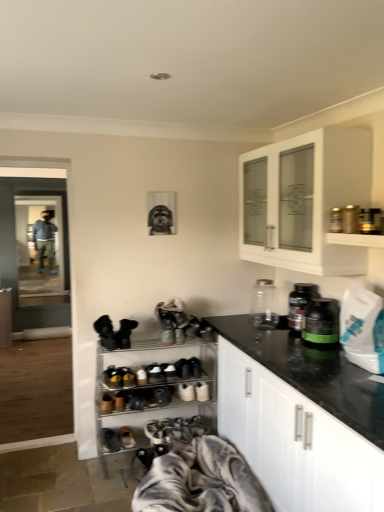
The image size is (384, 512). What do you see at coordinates (5, 317) in the screenshot?
I see `white glossy cabinet at left, placed as the second cabinetry when sorted from top to bottom` at bounding box center [5, 317].

The height and width of the screenshot is (512, 384). What are the coordinates of `metallic shoe rack at lower center, acting as the second shelf starting from the top` in the screenshot? It's located at pyautogui.click(x=155, y=388).

Could you tell me if white glossy cabinet at upper right, the 3th cabinetry when ordered from bottom to top, is turned towards transparent glass jar at right?

No, white glossy cabinet at upper right, the 3th cabinetry when ordered from bottom to top, does not turn towards transparent glass jar at right.

Does white glossy cabinet at upper right, the first cabinetry in the top-to-bottom sequence, appear on the right side of transparent glass jar at right?

Yes.

Is white glossy cabinet at upper right, which is the second cabinetry from front to back, not close to transparent glass jar at right?

No.

From the image's perspective, is white glossy cabinet at upper right, the first cabinetry in the top-to-bottom sequence, located above transparent glass jar at right?

Indeed, from the image's perspective, white glossy cabinet at upper right, the first cabinetry in the top-to-bottom sequence, is shown above transparent glass jar at right.

Based on the photo, considering the positions of objects white glossy shelf at upper right, the first shelf viewed from the top, and transparent glass jar at right in the image provided, who is more to the left, white glossy shelf at upper right, the first shelf viewed from the top, or transparent glass jar at right?

transparent glass jar at right.

In the image, there is a white glossy shelf at upper right, the second shelf when ordered from bottom to top. Where is `glass jar below it (from a real-world perspective)`? The width and height of the screenshot is (384, 512). glass jar below it (from a real-world perspective) is located at coordinates click(264, 305).

Can you tell me how much white glossy shelf at upper right, which is the first shelf in front-to-back order, and transparent glass jar at right differ in facing direction?

The facing directions of white glossy shelf at upper right, which is the first shelf in front-to-back order, and transparent glass jar at right are 0.091 degrees apart.

Does white glossy shelf at upper right, positioned as the 2th shelf in back-to-front order, have a smaller size compared to transparent glass jar at right?

Indeed, white glossy shelf at upper right, positioned as the 2th shelf in back-to-front order, has a smaller size compared to transparent glass jar at right.

From the image's perspective, which is above, black suede shoes at lower center, the 1th footwear positioned from the bottom, or black suede shoe at lower left, the fourth shoe positioned from the right?

black suede shoe at lower left, the fourth shoe positioned from the right, appears higher in the image.

Visually, is black suede shoes at lower center, which ranks as the fifth footwear in top-to-bottom order, positioned to the left or to the right of black suede shoe at lower left, the fourth shoe positioned from the right?

From the image, it's evident that black suede shoes at lower center, which ranks as the fifth footwear in top-to-bottom order, is to the right of black suede shoe at lower left, the fourth shoe positioned from the right.

Considering the relative sizes of black suede shoes at lower center, which ranks as the fifth footwear in top-to-bottom order, and black suede shoe at lower left, the first shoe from the left, in the image provided, is black suede shoes at lower center, which ranks as the fifth footwear in top-to-bottom order, wider than black suede shoe at lower left, the first shoe from the left,?

No, black suede shoes at lower center, which ranks as the fifth footwear in top-to-bottom order, is not wider than black suede shoe at lower left, the first shoe from the left.

From a real-world perspective, is black suede shoes at lower center, which ranks as the fifth footwear in top-to-bottom order, under black suede shoe at lower left, the first shoe from the left?

Yes, from a real-world perspective, black suede shoes at lower center, which ranks as the fifth footwear in top-to-bottom order, is below black suede shoe at lower left, the first shoe from the left.

Consider the image. Does white suede sneakers at center, which is the 2th footwear in top-to-bottom order, have a greater height compared to metallic shoe rack at lower center, acting as the second shelf starting from the top?

No.

Is white suede sneakers at center, which is the 2th footwear in top-to-bottom order, facing towards metallic shoe rack at lower center, the 2th shelf when ordered from front to back?

Yes, white suede sneakers at center, which is the 2th footwear in top-to-bottom order, is oriented towards metallic shoe rack at lower center, the 2th shelf when ordered from front to back.

How far apart are white suede sneakers at center, the fourth footwear when ordered from bottom to top, and metallic shoe rack at lower center, which ranks as the first shelf in back-to-front order?

white suede sneakers at center, the fourth footwear when ordered from bottom to top, is 12.64 inches from metallic shoe rack at lower center, which ranks as the first shelf in back-to-front order.

Identify the location of the 1st shelf in front of the white suede sneakers at center, which is the 2th footwear in top-to-bottom order, starting your count from the anchor. This screenshot has width=384, height=512. (155, 388).

Does green plastic container at upper right appear on the right side of leather shoe at lower center, which ranks as the 4th footwear in top-to-bottom order?

Yes, green plastic container at upper right is to the right of leather shoe at lower center, which ranks as the 4th footwear in top-to-bottom order.

Who is more distant, green plastic container at upper right or leather shoe at lower center, the 2th footwear in the bottom-to-top sequence?

leather shoe at lower center, the 2th footwear in the bottom-to-top sequence, is further from the camera.

From a real-world perspective, is green plastic container at upper right positioned above or below leather shoe at lower center, which ranks as the 4th footwear in top-to-bottom order?

Clearly, from a real-world perspective, green plastic container at upper right is above leather shoe at lower center, which ranks as the 4th footwear in top-to-bottom order.

Identify the location of the 3rd footwear behind when counting from the green plastic container at upper right. (110, 440).

Between point (314, 331) and point (270, 509), which one is positioned behind?

The point (314, 331) is farther.

Is green plastic container at upper right far from gray textured blanket at lower center?

Actually, green plastic container at upper right and gray textured blanket at lower center are a little close together.

Relative to gray textured blanket at lower center, is green plastic container at upper right in front or behind?

green plastic container at upper right is behind gray textured blanket at lower center.

Who is taller, green plastic container at upper right or gray textured blanket at lower center?

gray textured blanket at lower center.

Is black plastic bottle at upper right inside transparent glass door at left?

No, black plastic bottle at upper right is located outside of transparent glass door at left.

Who is taller, transparent glass door at left or black plastic bottle at upper right?

transparent glass door at left is taller.

From the image's perspective, which one is positioned higher, transparent glass door at left or black plastic bottle at upper right?

transparent glass door at left is shown above in the image.

Does transparent glass door at left have a larger size compared to black plastic bottle at upper right?

Indeed, transparent glass door at left has a larger size compared to black plastic bottle at upper right.

Find the location of a particular element. The image size is (384, 512). cabinetry that appears above the transparent glass jar at right (from the image's perspective) is located at coordinates (309, 198).

At what (x,y) coordinates should I click in order to perform the action: click on shelf above the transparent glass jar at right (from a real-world perspective). Please return your answer as a coordinate pair (x, y). Image resolution: width=384 pixels, height=512 pixels. Looking at the image, I should click on (356, 240).

Looking at the image, which one is located further to white glossy cabinet at upper right, the first cabinetry in the top-to-bottom sequence, transparent glass door at left or black matte shoe at center, which is the 4th shoe from left to right?

Based on the image, transparent glass door at left appears to be further to white glossy cabinet at upper right, the first cabinetry in the top-to-bottom sequence.

Based on their spatial positions, is black suede shoe at lower left, the fourth shoe positioned from the right, or yellow suede shoe at center, placed as the third shoe when sorted from right to left, closer to brown suede shoe at lower center, the 3th footwear in the bottom-to-top sequence?

The object closer to brown suede shoe at lower center, the 3th footwear in the bottom-to-top sequence, is yellow suede shoe at center, placed as the third shoe when sorted from right to left.

Considering their positions, is black plastic bottle at upper right positioned closer to black suede shoes at lower center, the 1th footwear positioned from the bottom, than white glossy cabinet at left, placed as the second cabinetry when sorted from top to bottom?

Based on the image, black plastic bottle at upper right appears to be nearer to black suede shoes at lower center, the 1th footwear positioned from the bottom.

Estimate the real-world distances between objects in this image. Which object is closer to metallic shoe rack at lower center, the 2th shelf when ordered from front to back, transparent glass door at left or black suede shoes at lower center, the 1th footwear positioned from the bottom?

black suede shoes at lower center, the 1th footwear positioned from the bottom.

From the image, which object appears to be nearer to white glossy shelf at upper right, positioned as the 2th shelf in back-to-front order, brown suede shoe at lower center, the 3th footwear in the bottom-to-top sequence, or white suede sneakers at center, the fourth footwear when ordered from bottom to top?

The object closer to white glossy shelf at upper right, positioned as the 2th shelf in back-to-front order, is white suede sneakers at center, the fourth footwear when ordered from bottom to top.

Which object lies nearer to the anchor point yellow suede shoe at center, placed as the second shoe when sorted from left to right, brown suede shoe at lower center, positioned as the 3th footwear in top-to-bottom order, or green plastic container at upper right?

brown suede shoe at lower center, positioned as the 3th footwear in top-to-bottom order, lies closer to yellow suede shoe at center, placed as the second shoe when sorted from left to right, than the other object.

Estimate the real-world distances between objects in this image. Which object is closer to black suede shoe at lower left, the fourth shoe positioned from the right, black suede shoes at center, which is counted as the 1th footwear, starting from the top, or white matte cabinet at lower right, which is the 1th cabinetry in bottom-to-top order?

black suede shoes at center, which is counted as the 1th footwear, starting from the top, lies closer to black suede shoe at lower left, the fourth shoe positioned from the right, than the other object.

When comparing their distances from black matte shoe at center, placed as the first shoe when sorted from right to left, does white glossy shelf at upper right, the second shelf when ordered from bottom to top, or transparent glass jar at right seem further?

Among the two, white glossy shelf at upper right, the second shelf when ordered from bottom to top, is located further to black matte shoe at center, placed as the first shoe when sorted from right to left.

Locate an element on the screen. glass jar situated between brown suede shoe at lower center, the 3th footwear in the bottom-to-top sequence, and black plastic bottle at upper right from left to right is located at coordinates pyautogui.click(x=264, y=305).

Locate an element on the screen. shelf between leather shoe at lower center, which ranks as the 4th footwear in top-to-bottom order, and white suede sneakers at center, which is the 2th footwear in top-to-bottom order, from left to right is located at coordinates (155, 388).

Where is `shoe situated between leather shoe at lower center, the 2th footwear in the bottom-to-top sequence, and black suede shoe at center, the 2th shoe when ordered from right to left, from left to right`? The height and width of the screenshot is (512, 384). shoe situated between leather shoe at lower center, the 2th footwear in the bottom-to-top sequence, and black suede shoe at center, the 2th shoe when ordered from right to left, from left to right is located at coordinates (112, 377).

Locate an element on the screen. beverage between white matte cabinet at lower right, positioned as the 3th cabinetry in top-to-bottom order, and black suede shoes at center, which is counted as the 1th footwear, starting from the top, along the z-axis is located at coordinates (300, 304).